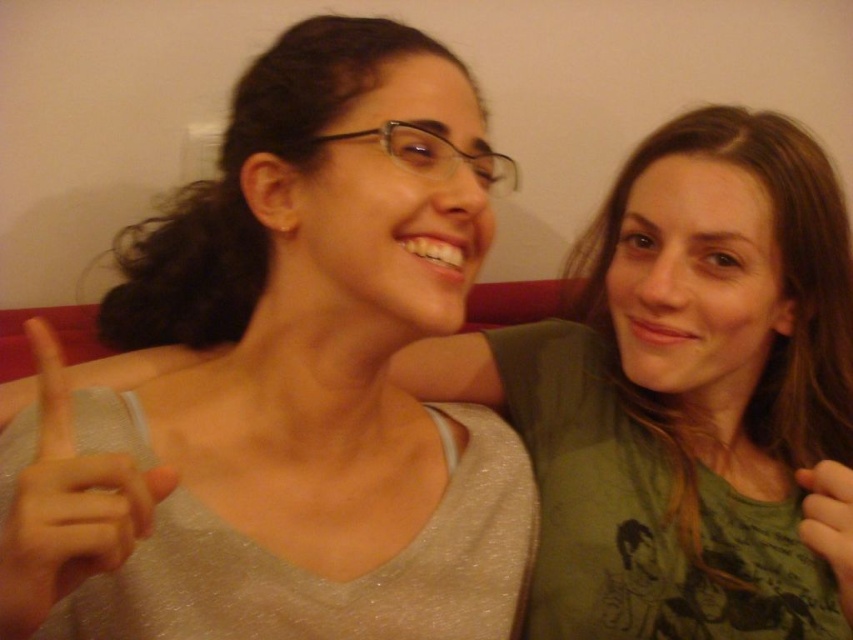
Does matte gray hand at left have a larger size compared to matte green t-shirt at right?

Yes.

Can you confirm if matte gray hand at left is thinner than matte green t-shirt at right?

No, matte gray hand at left is not thinner than matte green t-shirt at right.

Does point (68, 464) come closer to viewer compared to point (846, 548)?

Yes.

Locate an element on the screen. The width and height of the screenshot is (853, 640). matte gray hand at left is located at coordinates (67, 508).